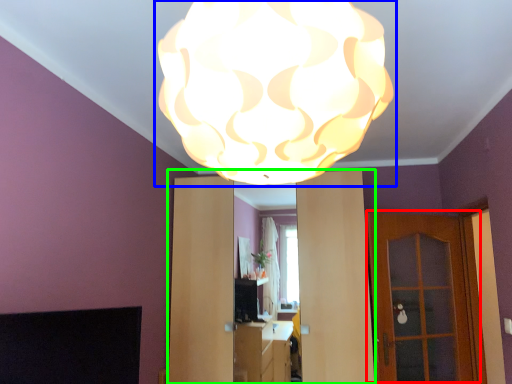
Question: Which is nearer to the door (highlighted by a red box)? lamp (highlighted by a blue box) or dresser (highlighted by a green box).

Choices:
 (A) lamp
 (B) dresser

Answer: (B)